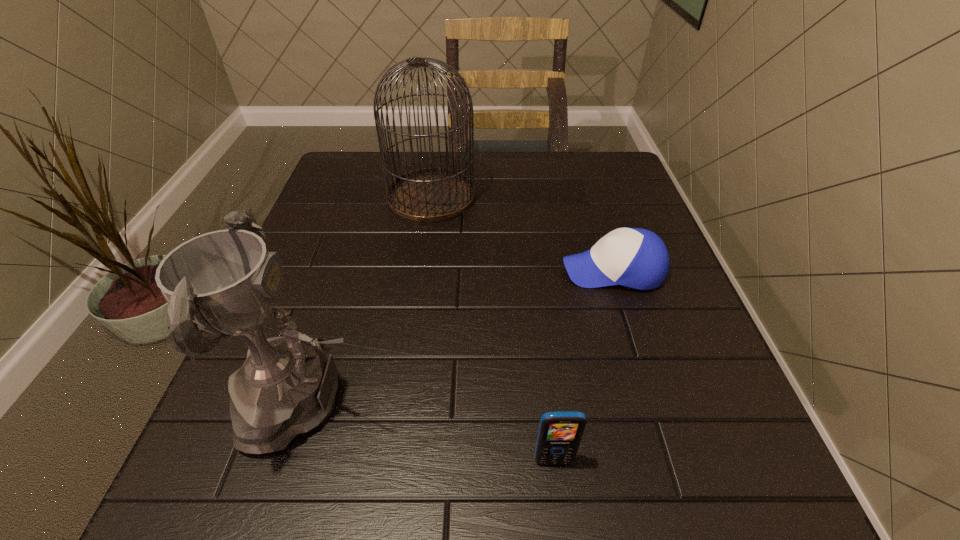
Locate an element on the screen. The image size is (960, 540). free space that is in between the rightmost object and the award is located at coordinates [x=461, y=336].

Find the location of a particular element. This screenshot has height=540, width=960. vacant point located between the shortest object and the cellular telephone is located at coordinates (583, 365).

Where is `vacant space in between the cellular telephone and the rightmost object`? The image size is (960, 540). vacant space in between the cellular telephone and the rightmost object is located at coordinates (583, 365).

Locate an element on the screen. vacant area that lies between the birdcage and the baseball cap is located at coordinates (522, 233).

At what (x,y) coordinates should I click in order to perform the action: click on the third closest object relative to the award. Please return your answer as a coordinate pair (x, y). Looking at the image, I should click on (433, 194).

Locate which object is the second closest to the award. Please provide its 2D coordinates. Your answer should be formatted as a tuple, i.e. [(x, y)], where the tuple contains the x and y coordinates of a point satisfying the conditions above.

[(637, 258)]

You are a GUI agent. You are given a task and a screenshot of the screen. Output one action in this format:
    pyautogui.click(x=<x>, y=<y>)
    Task: Click on the free spot that satisfies the following two spatial constraints: 1. on the front-facing side of the rightmost object; 2. on the screen of the third tallest object
    
    Given the screenshot: What is the action you would take?
    pyautogui.click(x=674, y=460)

Locate an element on the screen. The height and width of the screenshot is (540, 960). vacant region that satisfies the following two spatial constraints: 1. on the front-facing side of the baseball cap; 2. on the screen of the third tallest object is located at coordinates (674, 460).

Locate an element on the screen. This screenshot has width=960, height=540. vacant space that satisfies the following two spatial constraints: 1. on the front-facing side of the baseball cap; 2. on the screen of the second object from right to left is located at coordinates (674, 460).